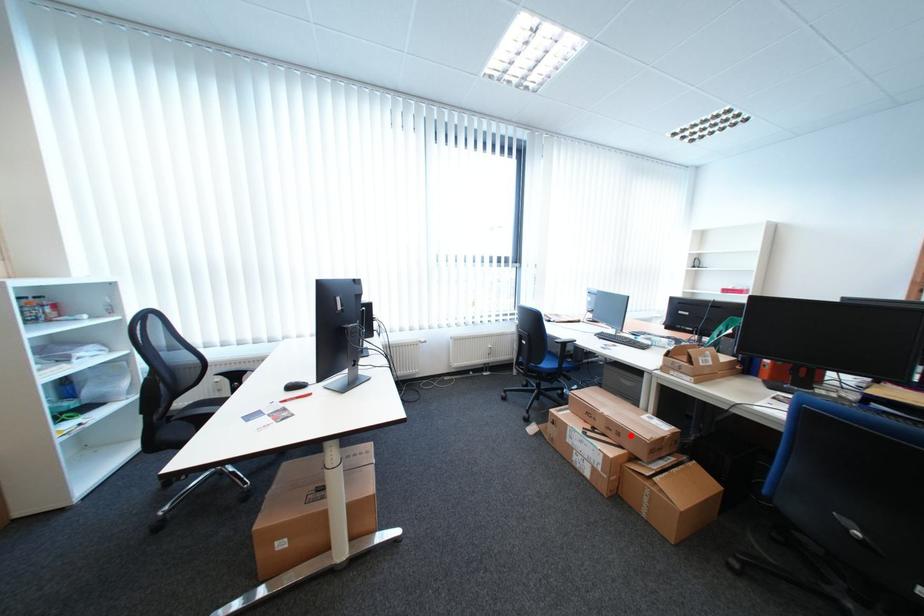
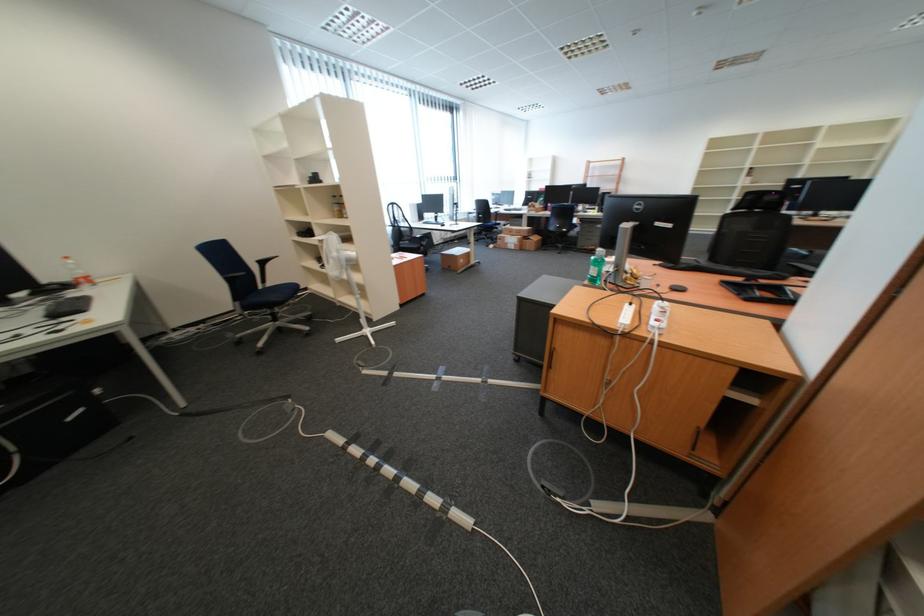
The point at the highlighted location is marked in the first image. Where is the corresponding point in the second image?

(531, 233)